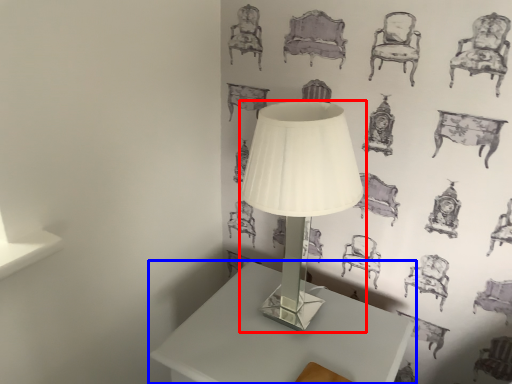
Question: Which object is closer to the camera taking this photo, lamp (highlighted by a red box) or table (highlighted by a blue box)?

Choices:
 (A) lamp
 (B) table

Answer: (A)